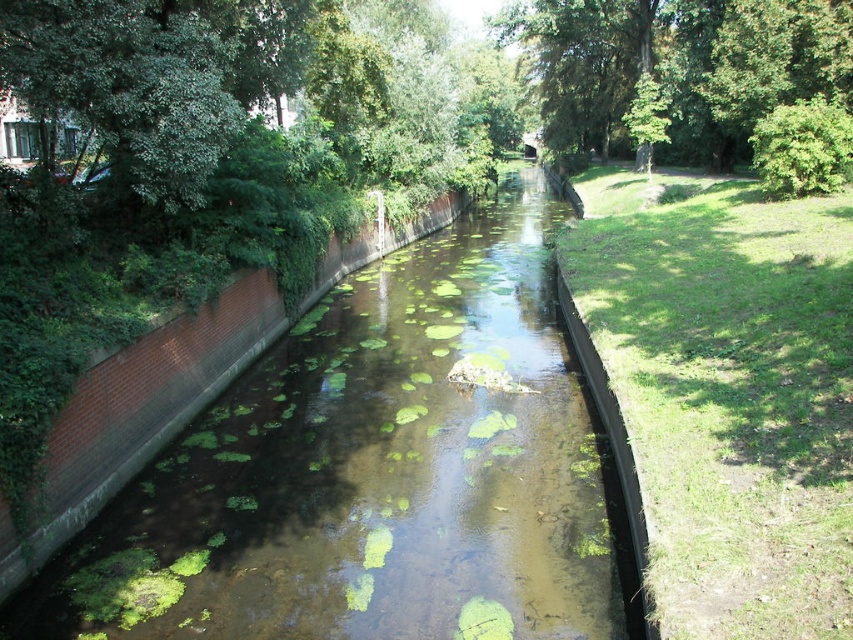
Who is positioned more to the right, green grass at right or green leafy tree at upper left?

green grass at right

Can you confirm if green grass at right is smaller than green leafy tree at upper left?

No.

Does point (585, 193) come farther from viewer compared to point (164, 186)?

Yes, point (585, 193) is farther from viewer.

Find the location of a particular element. green grass at right is located at coordinates (x=728, y=394).

Can you confirm if green algae-covered water at center is shorter than green grass at right?

Yes, green algae-covered water at center is shorter than green grass at right.

Identify the location of green algae-covered water at center. (376, 474).

Find the location of `green algae-covered water at center`. green algae-covered water at center is located at coordinates (376, 474).